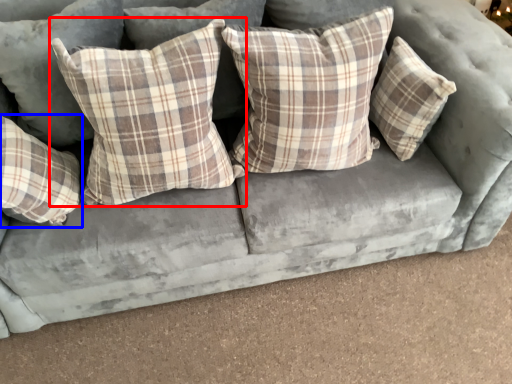
Question: Which object is further to the camera taking this photo, pillow (highlighted by a red box) or pillow (highlighted by a blue box)?

Choices:
 (A) pillow
 (B) pillow

Answer: (B)